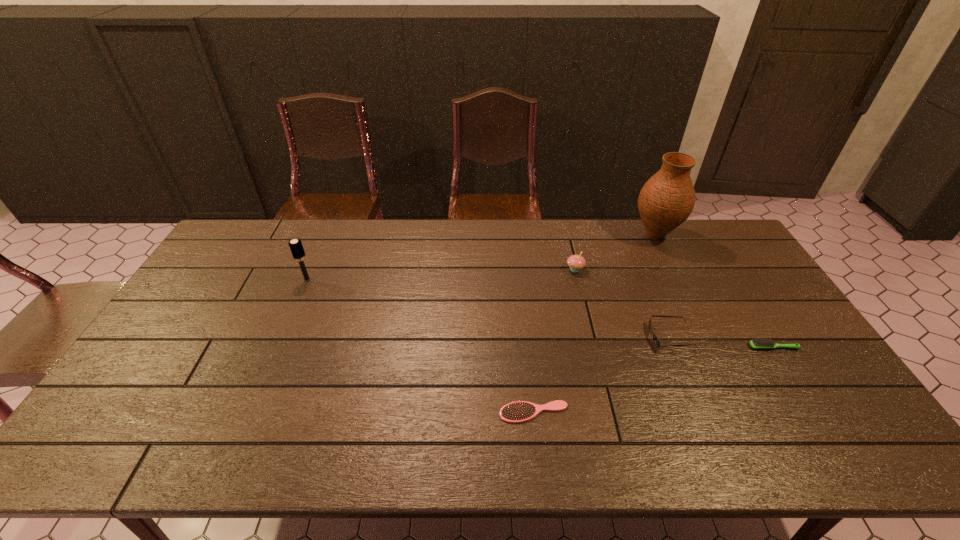
You are a GUI agent. You are given a task and a screenshot of the screen. Output one action in this format:
    pyautogui.click(x=<x>, y=<y>)
    Task: Click on the vase
    The image size is (960, 540).
    Given the screenshot: What is the action you would take?
    pyautogui.click(x=667, y=199)

Find the location of a particular element. The width and height of the screenshot is (960, 540). the tallest object is located at coordinates (667, 199).

The image size is (960, 540). I want to click on the second tallest object, so click(296, 247).

Where is `the leftmost object`? the leftmost object is located at coordinates (296, 247).

Locate an element on the screen. cupcake is located at coordinates (576, 262).

The height and width of the screenshot is (540, 960). Identify the location of the fourth shortest object. (576, 262).

The image size is (960, 540). What are the coordinates of `the third shortest object` in the screenshot? It's located at (656, 341).

Where is `the second nearest hairbrush`? The height and width of the screenshot is (540, 960). the second nearest hairbrush is located at coordinates (755, 344).

Where is `the rightmost object`? Image resolution: width=960 pixels, height=540 pixels. the rightmost object is located at coordinates (755, 344).

The height and width of the screenshot is (540, 960). In order to click on the nearest hairbrush in this screenshot , I will do `click(520, 411)`.